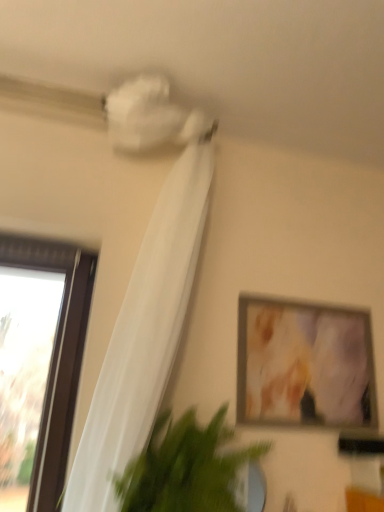
Image resolution: width=384 pixels, height=512 pixels. Describe the element at coordinates (185, 468) in the screenshot. I see `green leafy plant at lower left` at that location.

Identify the location of green leafy plant at lower left. This screenshot has width=384, height=512. (185, 468).

Which object is more forward, matte wooden picture frame at upper right or green leafy plant at lower left?

green leafy plant at lower left is more forward.

From the image's perspective, does matte wooden picture frame at upper right appear higher than green leafy plant at lower left?

Yes, from the image's perspective, matte wooden picture frame at upper right is over green leafy plant at lower left.

From a real-world perspective, who is located higher, matte wooden picture frame at upper right or green leafy plant at lower left?

From a 3D spatial view, matte wooden picture frame at upper right is above.

From the picture: Which is more to the left, matte wooden picture frame at upper right or green leafy plant at lower left?

green leafy plant at lower left is more to the left.

Is green leafy plant at lower left wider or thinner than matte wooden picture frame at upper right?

Considering their sizes, green leafy plant at lower left looks broader than matte wooden picture frame at upper right.

Is point (192, 407) closer or farther from the camera than point (273, 406)?

Point (192, 407).

Is green leafy plant at lower left spatially inside matte wooden picture frame at upper right, or outside of it?

green leafy plant at lower left lies outside matte wooden picture frame at upper right.

Is green leafy plant at lower left taller than matte wooden picture frame at upper right?

Incorrect, the height of green leafy plant at lower left is not larger of that of matte wooden picture frame at upper right.

Between matte wooden picture frame at upper right and white sheer curtain at upper left, which one is positioned in front?

white sheer curtain at upper left is closer to the camera.

Is point (248, 359) closer to camera compared to point (100, 452)?

No, (248, 359) is further to viewer.

Are matte wooden picture frame at upper right and white sheer curtain at upper left located far from each other?

Actually, matte wooden picture frame at upper right and white sheer curtain at upper left are a little close together.

Who is shorter, matte wooden picture frame at upper right or white sheer curtain at upper left?

Standing shorter between the two is matte wooden picture frame at upper right.

Is white sheer curtain at upper left taller than green leafy plant at lower left?

Yes.

Does white sheer curtain at upper left appear on the right side of green leafy plant at lower left?

No.

Is white sheer curtain at upper left placed right next to green leafy plant at lower left?

No.

Does point (133, 360) lie in front of point (225, 435)?

Yes, it is.

Would you say green leafy plant at lower left is a long distance from white sheer curtain at upper left?

Actually, green leafy plant at lower left and white sheer curtain at upper left are a little close together.

Considering the sizes of objects green leafy plant at lower left and white sheer curtain at upper left in the image provided, who is wider, green leafy plant at lower left or white sheer curtain at upper left?

green leafy plant at lower left.

Is green leafy plant at lower left oriented towards white sheer curtain at upper left?

Yes.

Image resolution: width=384 pixels, height=512 pixels. Find the location of `curtain above the green leafy plant at lower left (from the image's perspective)`. curtain above the green leafy plant at lower left (from the image's perspective) is located at coordinates (144, 335).

From a real-world perspective, between white sheer curtain at upper left and matte wooden picture frame at upper right, who is vertically higher?

white sheer curtain at upper left.

Considering the relative sizes of white sheer curtain at upper left and matte wooden picture frame at upper right in the image provided, is white sheer curtain at upper left shorter than matte wooden picture frame at upper right?

Incorrect, the height of white sheer curtain at upper left does not fall short of that of matte wooden picture frame at upper right.

Is white sheer curtain at upper left oriented towards matte wooden picture frame at upper right?

No, white sheer curtain at upper left is not facing towards matte wooden picture frame at upper right.

Locate an element on the screen. The image size is (384, 512). curtain that appears above the matte wooden picture frame at upper right (from a real-world perspective) is located at coordinates (144, 335).

The height and width of the screenshot is (512, 384). I want to click on picture frame above the green leafy plant at lower left (from a real-world perspective), so click(304, 365).

Find the location of a particular element. Image resolution: width=384 pixels, height=512 pixels. houseplant that is on the left side of matte wooden picture frame at upper right is located at coordinates (185, 468).

Looking at the image, which one is located further to matte wooden picture frame at upper right, white sheer curtain at upper left or green leafy plant at lower left?

The object further to matte wooden picture frame at upper right is white sheer curtain at upper left.

When comparing their distances from white sheer curtain at upper left, does green leafy plant at lower left or matte wooden picture frame at upper right seem further?

matte wooden picture frame at upper right is positioned further to the anchor white sheer curtain at upper left.

When comparing their distances from green leafy plant at lower left, does white sheer curtain at upper left or matte wooden picture frame at upper right seem closer?

Based on the image, white sheer curtain at upper left appears to be nearer to green leafy plant at lower left.

Which object lies further to the anchor point green leafy plant at lower left, matte wooden picture frame at upper right or white sheer curtain at upper left?

matte wooden picture frame at upper right is positioned further to the anchor green leafy plant at lower left.

Which object lies nearer to the anchor point matte wooden picture frame at upper right, green leafy plant at lower left or white sheer curtain at upper left?

green leafy plant at lower left.

When comparing their distances from white sheer curtain at upper left, does matte wooden picture frame at upper right or green leafy plant at lower left seem closer?

green leafy plant at lower left lies closer to white sheer curtain at upper left than the other object.

The height and width of the screenshot is (512, 384). Find the location of `houseplant between white sheer curtain at upper left and matte wooden picture frame at upper right along the z-axis`. houseplant between white sheer curtain at upper left and matte wooden picture frame at upper right along the z-axis is located at coordinates (185, 468).